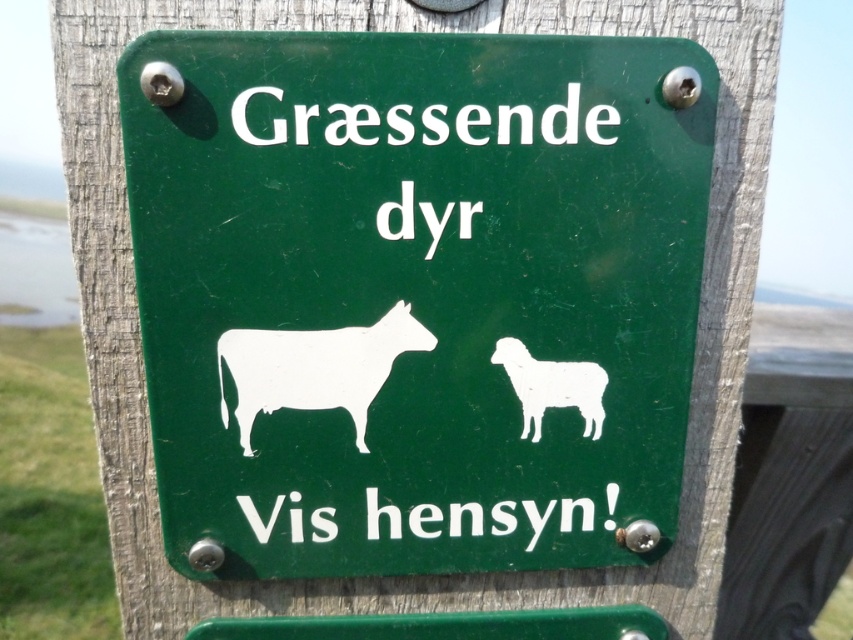
Question: Does white paper sheep at center have a smaller size compared to white matte sheep at center?

Choices:
 (A) yes
 (B) no

Answer: (B)

Question: Among these objects, which one is farthest from the camera?

Choices:
 (A) white matte sheep at center
 (B) green matte sign at center

Answer: (A)

Question: Is white paper sheep at center above white matte sheep at center?

Choices:
 (A) yes
 (B) no

Answer: (A)

Question: Can you confirm if green matte sign at center is positioned below white paper sheep at center?

Choices:
 (A) no
 (B) yes

Answer: (A)

Question: Estimate the real-world distances between objects in this image. Which object is farther from the white paper sheep at center?

Choices:
 (A) white matte sheep at center
 (B) green matte sign at center

Answer: (A)

Question: Which object is the farthest from the green matte sign at center?

Choices:
 (A) white paper sheep at center
 (B) white matte sheep at center

Answer: (B)